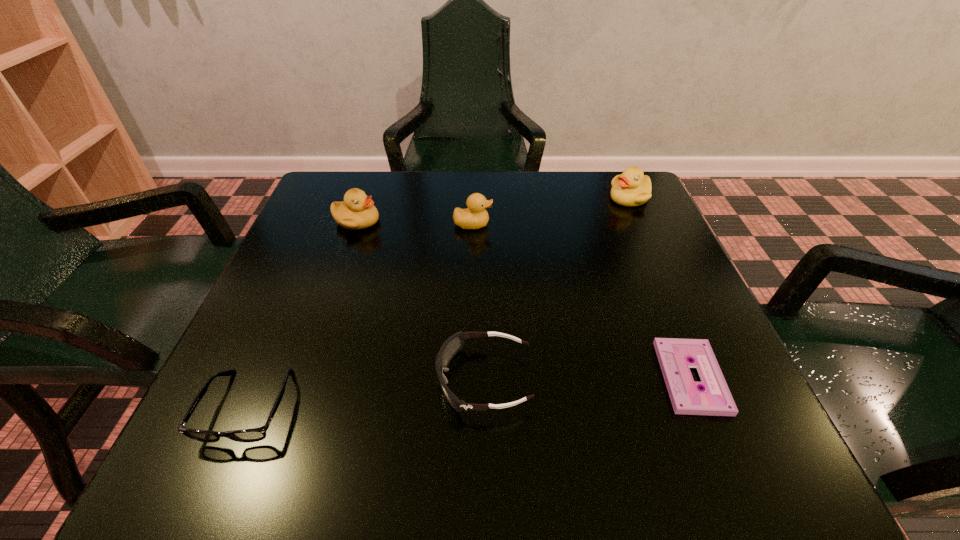
I want to click on free spot between the rightmost duckling and the spectacles, so click(x=439, y=302).

Image resolution: width=960 pixels, height=540 pixels. In order to click on object that ranks as the fourth closest to the second duckling from right to left in this screenshot , I will do `click(674, 355)`.

Where is `object that is the fourth closest to the leftmost duckling`? Image resolution: width=960 pixels, height=540 pixels. object that is the fourth closest to the leftmost duckling is located at coordinates (632, 188).

Image resolution: width=960 pixels, height=540 pixels. Identify the location of duckling that stands as the second closest to the goggles. (357, 211).

This screenshot has width=960, height=540. I want to click on duckling that stands as the second closest to the rightmost duckling, so click(x=357, y=211).

The width and height of the screenshot is (960, 540). Find the location of `free spot that satisfies the following two spatial constraints: 1. on the front-facing side of the leftmost duckling; 2. on the lenses of the spectacles`. free spot that satisfies the following two spatial constraints: 1. on the front-facing side of the leftmost duckling; 2. on the lenses of the spectacles is located at coordinates (292, 407).

This screenshot has width=960, height=540. I want to click on free location that satisfies the following two spatial constraints: 1. on the front-facing side of the leftmost duckling; 2. on the lenses of the spectacles, so click(292, 407).

I want to click on free location that satisfies the following two spatial constraints: 1. on the face of the second duckling from right to left; 2. on the back side of the videotape, so click(x=469, y=377).

Locate an element on the screen. free space that satisfies the following two spatial constraints: 1. on the face of the shortest object; 2. on the right side of the second duckling from left to right is located at coordinates [x=469, y=377].